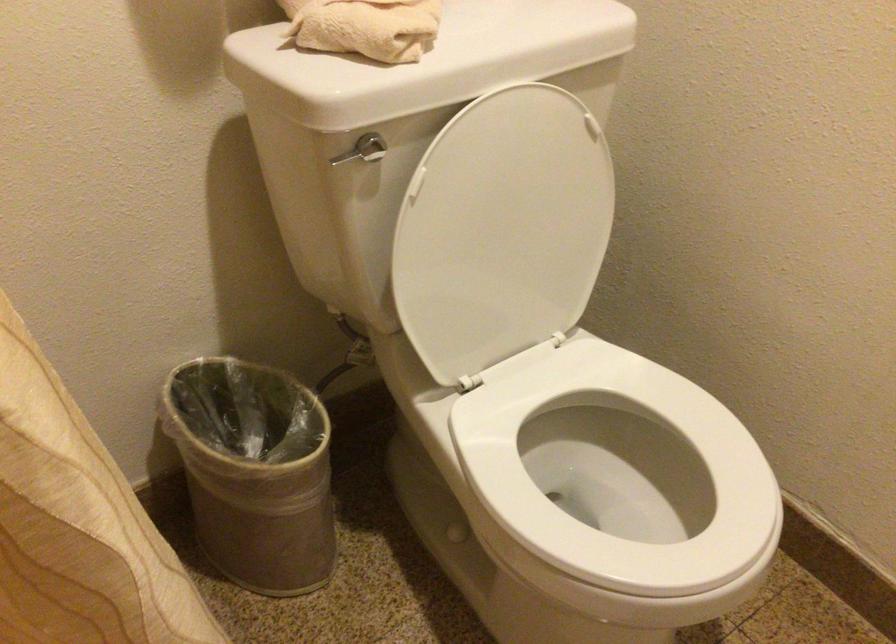
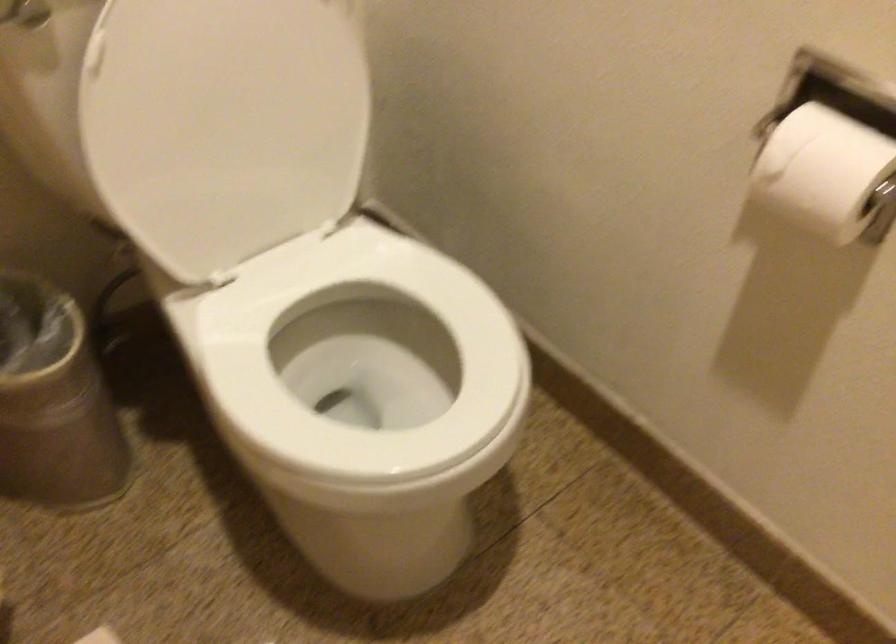
In the second image, find the point that corresponds to (295,494) in the first image.

(54, 402)